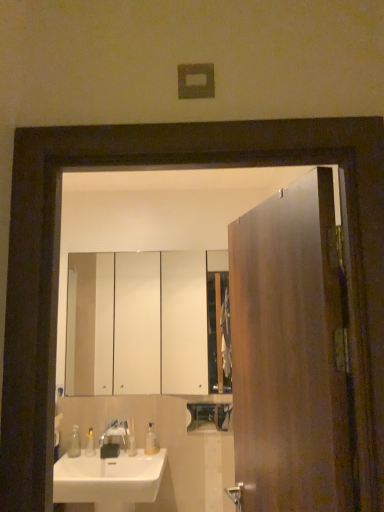
Question: Is satin nickel faucet at sink left bigger than translucent plastic soap at center, marked as the first toiletry in a right-to-left arrangement?

Choices:
 (A) no
 (B) yes

Answer: (B)

Question: Does satin nickel faucet at sink left come behind translucent plastic soap at center, which is the 2th toiletry from left to right?

Choices:
 (A) yes
 (B) no

Answer: (B)

Question: From a real-world perspective, is satin nickel faucet at sink left over translucent plastic soap at center, which is the 2th toiletry from left to right?

Choices:
 (A) yes
 (B) no

Answer: (A)

Question: Considering the relative positions of satin nickel faucet at sink left and translucent plastic soap at center, marked as the first toiletry in a right-to-left arrangement, in the image provided, is satin nickel faucet at sink left to the left of translucent plastic soap at center, marked as the first toiletry in a right-to-left arrangement, from the viewer's perspective?

Choices:
 (A) yes
 (B) no

Answer: (A)

Question: From a real-world perspective, is satin nickel faucet at sink left under translucent plastic soap at center, marked as the first toiletry in a right-to-left arrangement?

Choices:
 (A) yes
 (B) no

Answer: (B)

Question: Which is correct: satin nickel faucet at sink left is inside white glossy sink at lower left, or outside of it?

Choices:
 (A) outside
 (B) inside

Answer: (A)

Question: From the image's perspective, is satin nickel faucet at sink left positioned above or below white glossy sink at lower left?

Choices:
 (A) above
 (B) below

Answer: (A)

Question: Is point (105, 437) positioned closer to the camera than point (69, 501)?

Choices:
 (A) closer
 (B) farther

Answer: (B)

Question: Considering the positions of satin nickel faucet at sink left and white glossy sink at lower left in the image, is satin nickel faucet at sink left bigger or smaller than white glossy sink at lower left?

Choices:
 (A) big
 (B) small

Answer: (B)

Question: Choose the correct answer: Is transparent plastic soap dispenser at lower center, the 2th soap dispenser from the left, inside translucent plastic soap at lower left, which is counted as the 2th toiletry, starting from the right, or outside it?

Choices:
 (A) outside
 (B) inside

Answer: (A)

Question: Considering the positions of transparent plastic soap dispenser at lower center, the 2th soap dispenser from the left, and translucent plastic soap at lower left, which is the first toiletry in left-to-right order, in the image, is transparent plastic soap dispenser at lower center, the 2th soap dispenser from the left, taller or shorter than translucent plastic soap at lower left, which is the first toiletry in left-to-right order,?

Choices:
 (A) tall
 (B) short

Answer: (A)

Question: Considering the positions of point (147, 436) and point (91, 440), is point (147, 436) closer or farther from the camera than point (91, 440)?

Choices:
 (A) closer
 (B) farther

Answer: (B)

Question: From a real-world perspective, is transparent plastic soap dispenser at lower center, which ranks as the first soap dispenser in right-to-left order, physically located above or below translucent plastic soap at lower left, which is counted as the 2th toiletry, starting from the right?

Choices:
 (A) below
 (B) above

Answer: (B)

Question: Considering the positions of translucent plastic soap at lower left, which is counted as the 2th toiletry, starting from the right, and white glossy sink at lower left in the image, is translucent plastic soap at lower left, which is counted as the 2th toiletry, starting from the right, bigger or smaller than white glossy sink at lower left?

Choices:
 (A) big
 (B) small

Answer: (B)

Question: Visually, is translucent plastic soap at lower left, which is the first toiletry in left-to-right order, positioned to the left or to the right of white glossy sink at lower left?

Choices:
 (A) right
 (B) left

Answer: (B)